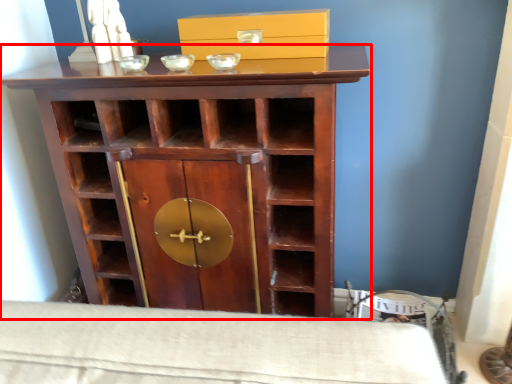
Question: From the image's perspective, where is cupboard (annotated by the red box) located relative to box?

Choices:
 (A) below
 (B) above

Answer: (A)